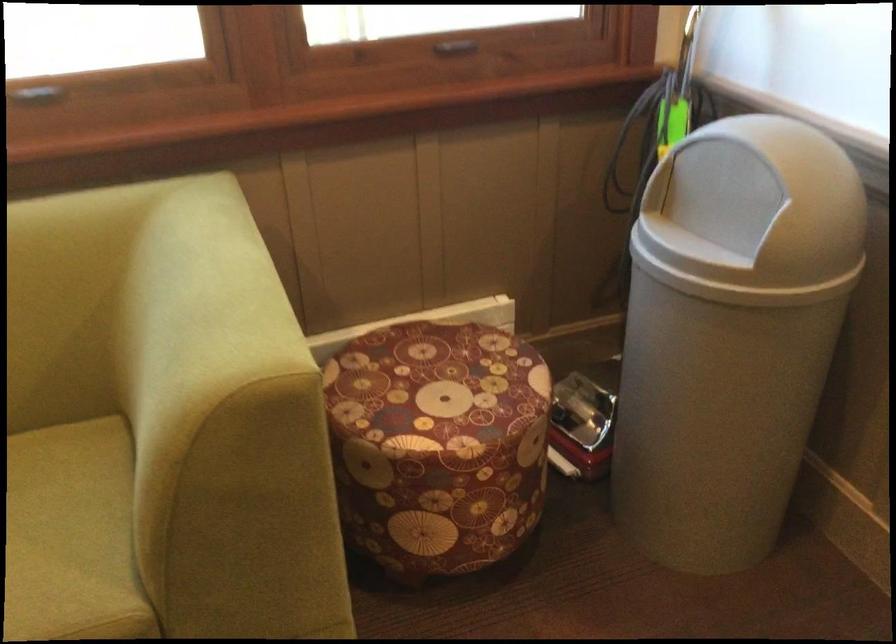
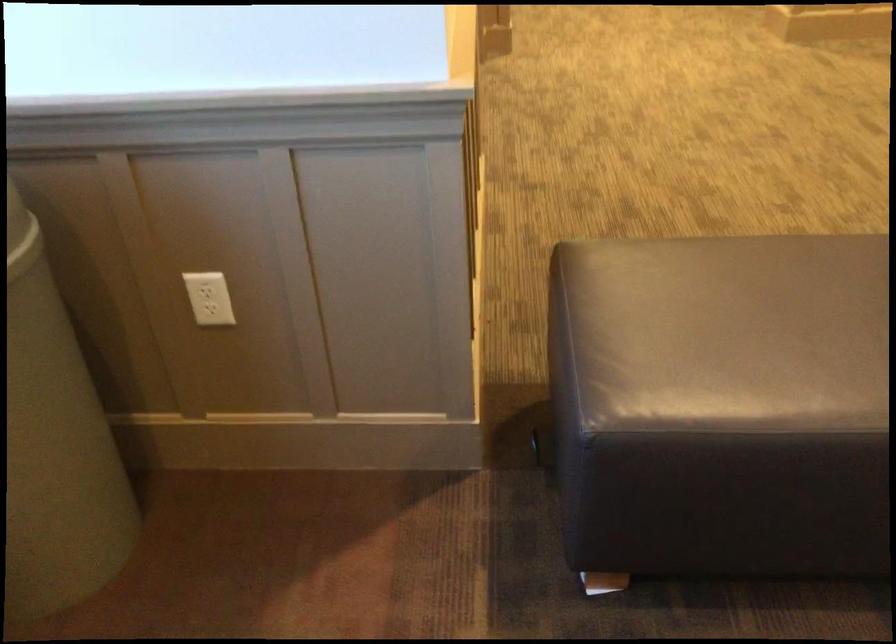
Question: The camera is either moving clockwise (left) or counter-clockwise (right) around the object. The first image is from the beginning of the video and the second image is from the end. Is the camera moving left or right when shooting the video?

Choices:
 (A) Left
 (B) Right

Answer: (A)